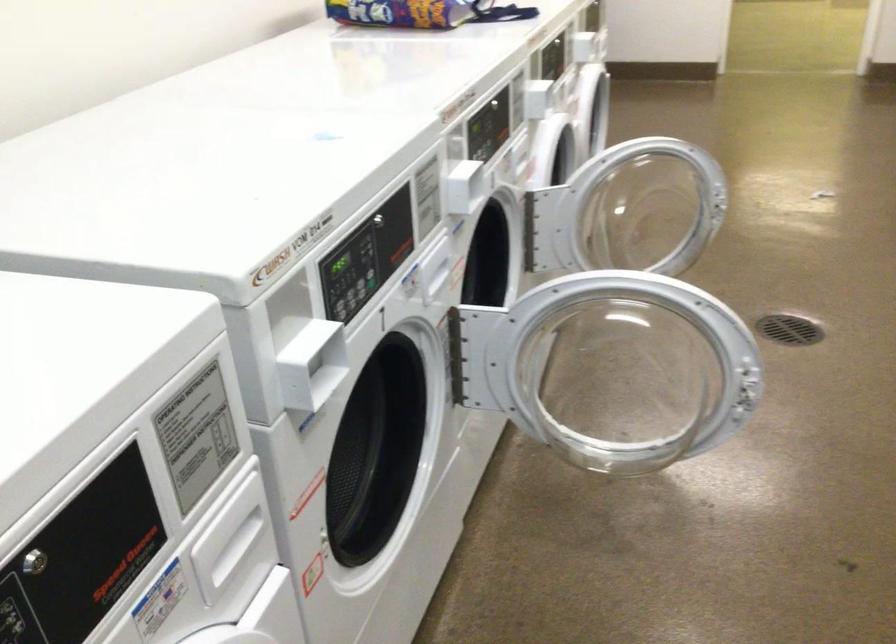
Question: The first image is from the beginning of the video and the second image is from the end. How did the camera likely rotate when shooting the video?

Choices:
 (A) Left
 (B) Right
 (C) Up
 (D) Down

Answer: (A)